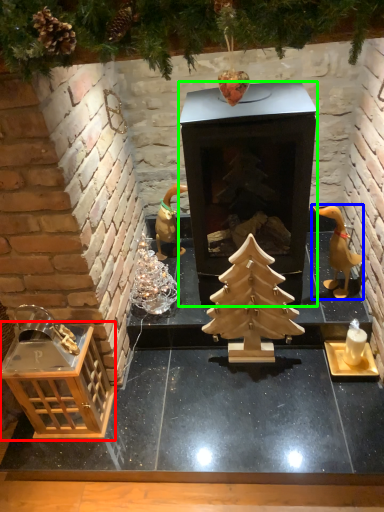
Question: Which object is the closest to the crate (highlighted by a red box)? Choose among these: toy (highlighted by a blue box) or fireplace (highlighted by a green box).

Choices:
 (A) toy
 (B) fireplace

Answer: (B)